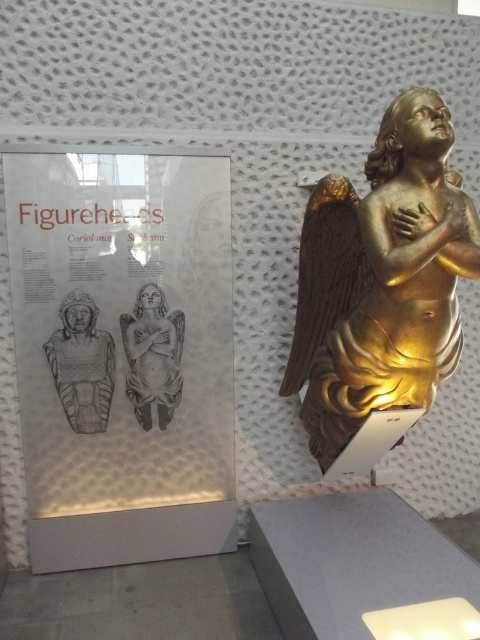
Which is more to the left, matte stone figure at center or matte gray stone angel at center?

matte stone figure at center

Can you confirm if matte stone figure at center is shorter than matte gray stone angel at center?

Indeed, matte stone figure at center has a lesser height compared to matte gray stone angel at center.

Is point (80, 346) farther from camera compared to point (168, 349)?

No.

Locate an element on the screen. matte stone figure at center is located at coordinates (82, 364).

Which of these two, gold polished wood angel at right or matte gray stone angel at center, stands taller?

Standing taller between the two is gold polished wood angel at right.

Does point (398, 150) lie in front of point (147, 307)?

Yes, it is in front of point (147, 307).

Which is in front, point (409, 211) or point (176, 362)?

Point (409, 211) is in front.

Image resolution: width=480 pixels, height=640 pixels. In order to click on gold polished wood angel at right in this screenshot , I will do `click(382, 278)`.

Between point (460, 179) and point (58, 392), which one is positioned in front?

Point (460, 179) is in front.

Which is more to the right, gold polished wood angel at right or matte stone figure at center?

Positioned to the right is gold polished wood angel at right.

Is point (372, 349) positioned in front of point (69, 296)?

Yes, point (372, 349) is in front of point (69, 296).

Where is `gold polished wood angel at right`? The image size is (480, 640). gold polished wood angel at right is located at coordinates (382, 278).